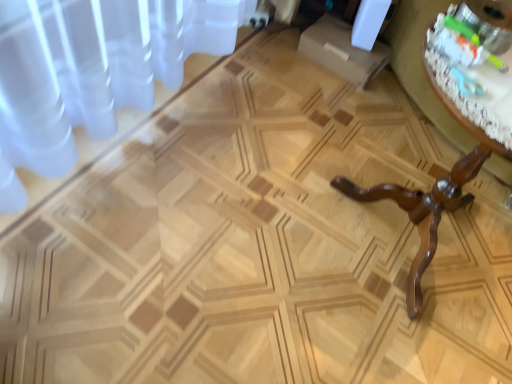
This screenshot has height=384, width=512. I want to click on free point to the left of wooden table at right, so click(x=257, y=214).